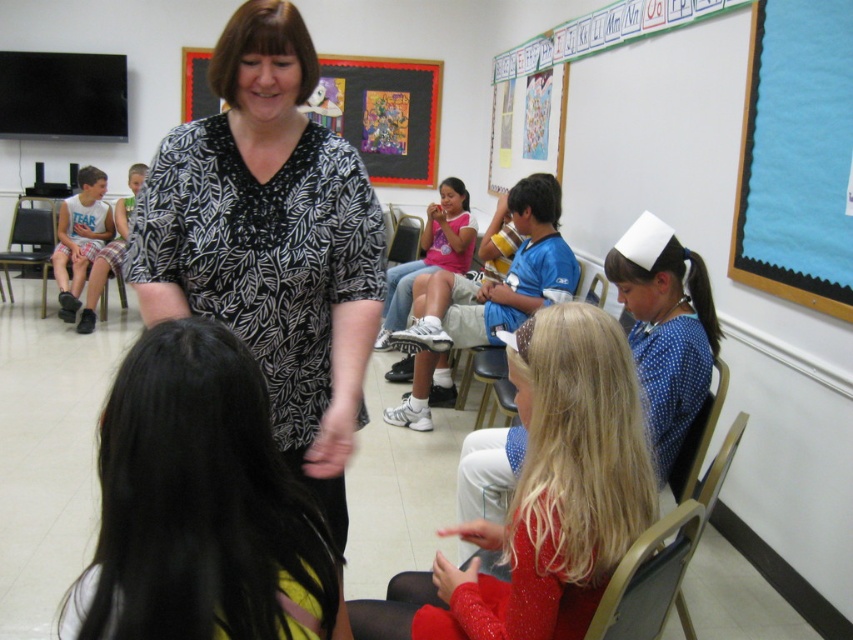
Find the location of a particular element. The width and height of the screenshot is (853, 640). black printed dress at center is located at coordinates (200, 504).

What do you see at coordinates (200, 504) in the screenshot? The width and height of the screenshot is (853, 640). I see `black printed dress at center` at bounding box center [200, 504].

Locate an element on the screen. This screenshot has width=853, height=640. black printed dress at center is located at coordinates (200, 504).

Does pink fabric shirt at center appear over black leather chair at left?

No, pink fabric shirt at center is not above black leather chair at left.

Can you confirm if pink fabric shirt at center is bigger than black leather chair at left?

Incorrect, pink fabric shirt at center is not larger than black leather chair at left.

Find the location of a particular element. The height and width of the screenshot is (640, 853). pink fabric shirt at center is located at coordinates click(430, 253).

Consider the image. Can you confirm if black printed blouse at center is smaller than plaid shorts at left?

Correct, black printed blouse at center occupies less space than plaid shorts at left.

Can you confirm if black printed blouse at center is positioned above plaid shorts at left?

No, black printed blouse at center is not above plaid shorts at left.

Image resolution: width=853 pixels, height=640 pixels. Describe the element at coordinates (271, 243) in the screenshot. I see `black printed blouse at center` at that location.

Where is `black printed blouse at center`? The image size is (853, 640). black printed blouse at center is located at coordinates (271, 243).